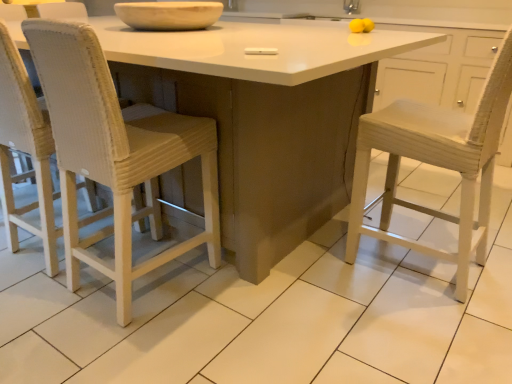
Question: Looking at the image, does white matte table at center seem bigger or smaller compared to silver metallic faucet at upper right?

Choices:
 (A) big
 (B) small

Answer: (A)

Question: Based on their positions, is white matte table at center located to the left or right of silver metallic faucet at upper right?

Choices:
 (A) left
 (B) right

Answer: (A)

Question: Which of these objects is positioned closest to the woven white chair at left?

Choices:
 (A) white matte table at center
 (B) silver metallic faucet at upper right
 (C) matte white bowl at upper center

Answer: (A)

Question: Based on their relative distances, which object is farther from the matte white bowl at upper center?

Choices:
 (A) white matte table at center
 (B) woven white chair at left
 (C) silver metallic faucet at upper right

Answer: (C)